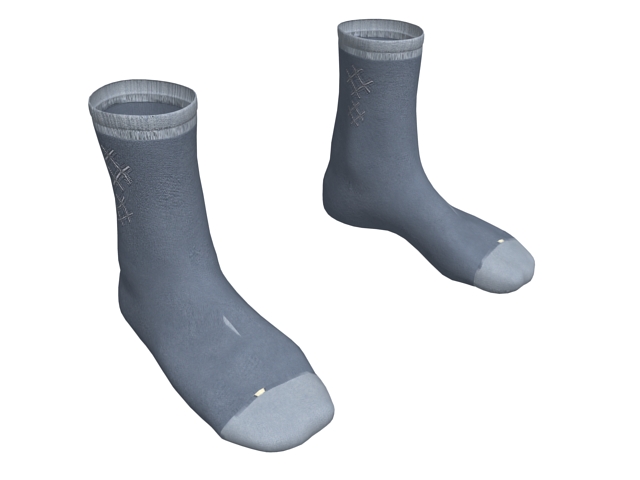
At what (x,y) coordinates should I click in order to perform the action: click on right sock displayed in image. Please return your answer as a coordinate pair (x, y). Looking at the image, I should click on (370, 152).